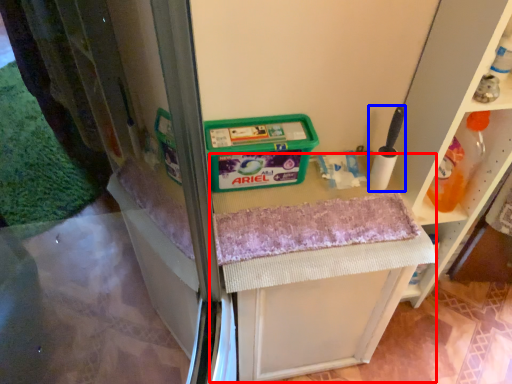
Question: Among these objects, which one is farthest to the camera, vanity (highlighted by a red box) or brush (highlighted by a blue box)?

Choices:
 (A) vanity
 (B) brush

Answer: (A)